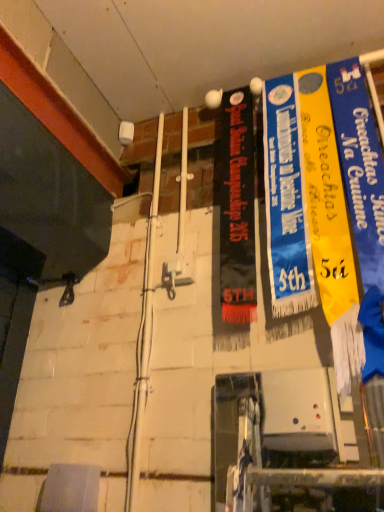
Question: Does point [x=269, y=97] appear closer or farther from the camera than point [x=349, y=239]?

Choices:
 (A) closer
 (B) farther

Answer: (B)

Question: Considering the positions of blue fabric banner at center, the 2th poster when ordered from right to left, and yellow fabric banner at right, which is counted as the second poster, starting from the left, in the image, is blue fabric banner at center, the 2th poster when ordered from right to left, wider or thinner than yellow fabric banner at right, which is counted as the second poster, starting from the left,?

Choices:
 (A) wide
 (B) thin

Answer: (B)

Question: Looking at the image, does blue fabric banner at center, the 2th poster when ordered from right to left, seem bigger or smaller compared to yellow fabric banner at right, the 1th poster positioned from the right?

Choices:
 (A) big
 (B) small

Answer: (B)

Question: Is yellow fabric banner at right, the 1th poster positioned from the right, to the left or to the right of blue fabric banner at center, the 2th poster when ordered from right to left, in the image?

Choices:
 (A) left
 (B) right

Answer: (B)

Question: From a real-world perspective, is yellow fabric banner at right, which is counted as the second poster, starting from the left, above or below blue fabric banner at center, the first poster from the left?

Choices:
 (A) below
 (B) above

Answer: (A)

Question: Considering their positions, is yellow fabric banner at right, the 1th poster positioned from the right, located in front of or behind blue fabric banner at center, the first poster from the left?

Choices:
 (A) behind
 (B) front

Answer: (B)

Question: Is point (336, 244) closer or farther from the camera than point (281, 229)?

Choices:
 (A) farther
 (B) closer

Answer: (B)